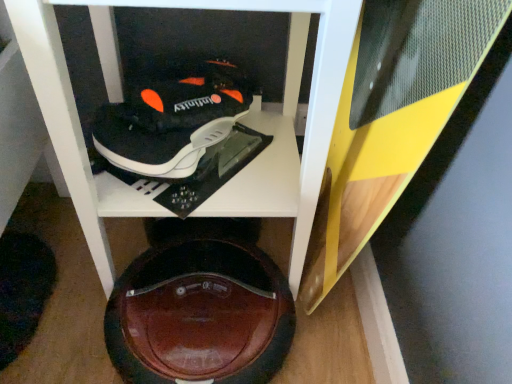
Question: From the image's perspective, is shiny brown shoe at bottom center located beneath wooden cabinet at center?

Choices:
 (A) no
 (B) yes

Answer: (B)

Question: Considering the relative positions of shiny brown shoe at bottom center and wooden cabinet at center in the image provided, is shiny brown shoe at bottom center to the left of wooden cabinet at center from the viewer's perspective?

Choices:
 (A) yes
 (B) no

Answer: (A)

Question: From a real-world perspective, is shiny brown shoe at bottom center on top of wooden cabinet at center?

Choices:
 (A) no
 (B) yes

Answer: (A)

Question: Is shiny brown shoe at bottom center at the right side of wooden cabinet at center?

Choices:
 (A) no
 (B) yes

Answer: (A)

Question: Can you confirm if shiny brown shoe at bottom center is thinner than wooden cabinet at center?

Choices:
 (A) no
 (B) yes

Answer: (B)

Question: Is wooden cabinet at center surrounded by shiny brown shoe at bottom center?

Choices:
 (A) no
 (B) yes

Answer: (A)

Question: Is wooden cabinet at center beside black matte shoe at upper center?

Choices:
 (A) no
 (B) yes

Answer: (B)

Question: From a real-world perspective, is wooden cabinet at center under black matte shoe at upper center?

Choices:
 (A) no
 (B) yes

Answer: (B)

Question: Can you confirm if wooden cabinet at center is wider than black matte shoe at upper center?

Choices:
 (A) yes
 (B) no

Answer: (A)

Question: Considering the relative positions of wooden cabinet at center and black matte shoe at upper center in the image provided, is wooden cabinet at center to the right of black matte shoe at upper center from the viewer's perspective?

Choices:
 (A) yes
 (B) no

Answer: (A)

Question: Is wooden cabinet at center further to the viewer compared to black matte shoe at upper center?

Choices:
 (A) no
 (B) yes

Answer: (A)

Question: Are wooden cabinet at center and black matte shoe at upper center located far from each other?

Choices:
 (A) no
 (B) yes

Answer: (A)

Question: Are black matte shoe at upper center and shiny brown shoe at bottom center far apart?

Choices:
 (A) yes
 (B) no

Answer: (B)